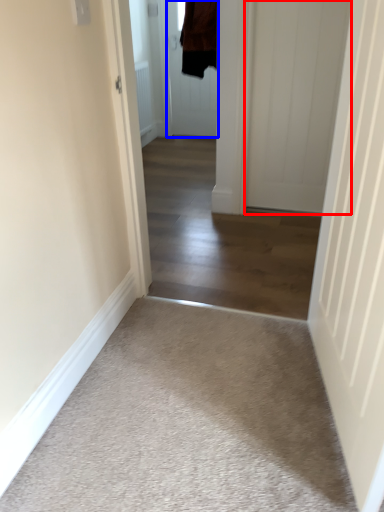
Question: Which object appears farthest to the camera in this image, door (highlighted by a red box) or door (highlighted by a blue box)?

Choices:
 (A) door
 (B) door

Answer: (B)